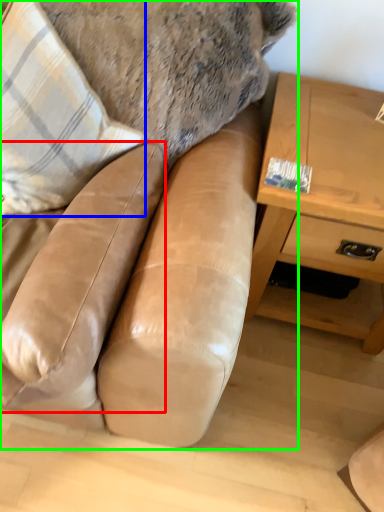
Question: Considering the real-world distances, which object is farthest from swivel chair (highlighted by a red box)? throw pillow (highlighted by a blue box) or studio couch (highlighted by a green box)?

Choices:
 (A) throw pillow
 (B) studio couch

Answer: (A)